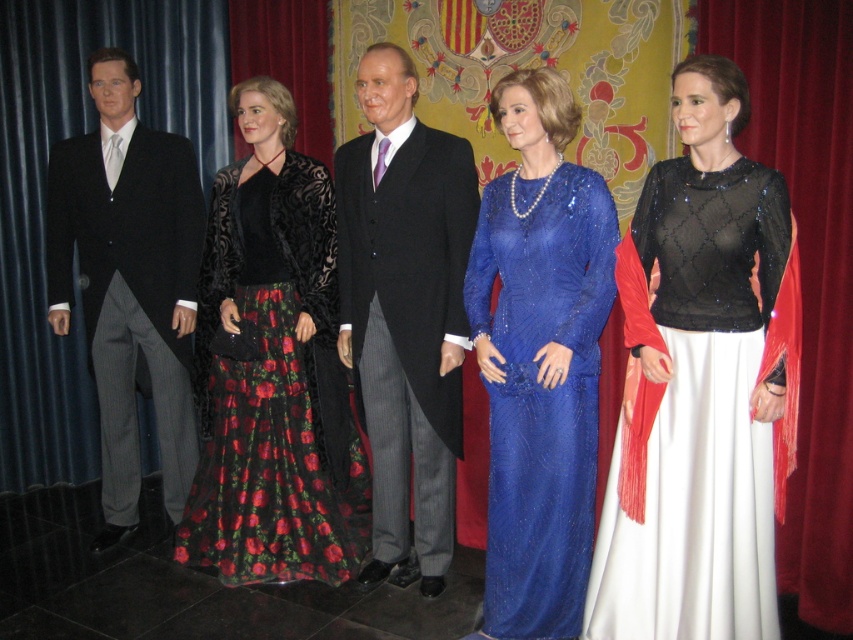
Question: Is blue sequined dress at center closer to the viewer compared to matte black suit at left?

Choices:
 (A) no
 (B) yes

Answer: (B)

Question: Is the position of blue sequined dress at center less distant than that of matte black suit at center?

Choices:
 (A) no
 (B) yes

Answer: (B)

Question: Does velvet black dress at center appear on the right side of blue sequined dress at center?

Choices:
 (A) yes
 (B) no

Answer: (B)

Question: Which point is farther to the camera?

Choices:
 (A) matte black suit at center
 (B) velvet black dress at center

Answer: (B)

Question: Which of these objects is positioned closest to the matte black suit at left?

Choices:
 (A) matte black suit at center
 (B) black sequined dress at center
 (C) velvet black dress at center
 (D) blue sequined dress at center

Answer: (C)

Question: Which object is farther from the camera taking this photo?

Choices:
 (A) black sequined dress at center
 (B) blue sequined dress at center
 (C) matte black suit at left
 (D) matte black suit at center

Answer: (C)